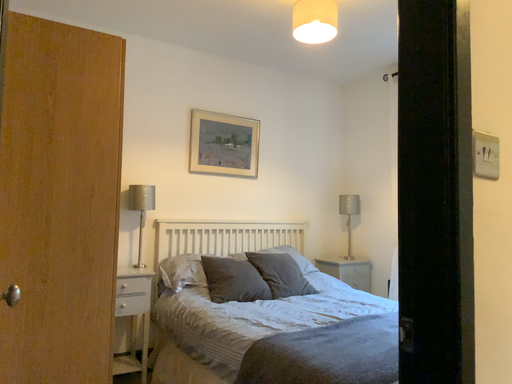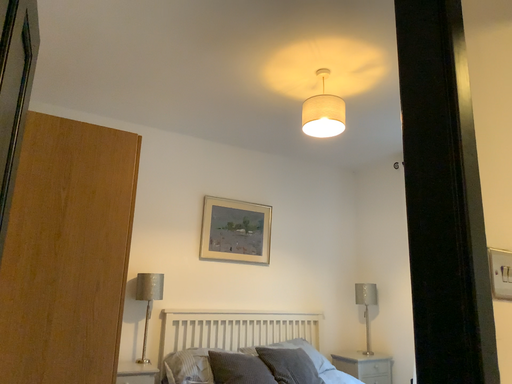
Question: Which way did the camera rotate in the video?

Choices:
 (A) rotated downward
 (B) rotated upward

Answer: (B)